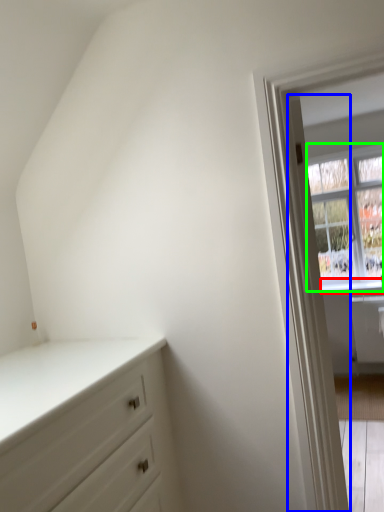
Question: Which object is the farthest from window sill (highlighted by a red box)? Choose among these: door (highlighted by a blue box) or window (highlighted by a green box).

Choices:
 (A) door
 (B) window

Answer: (A)